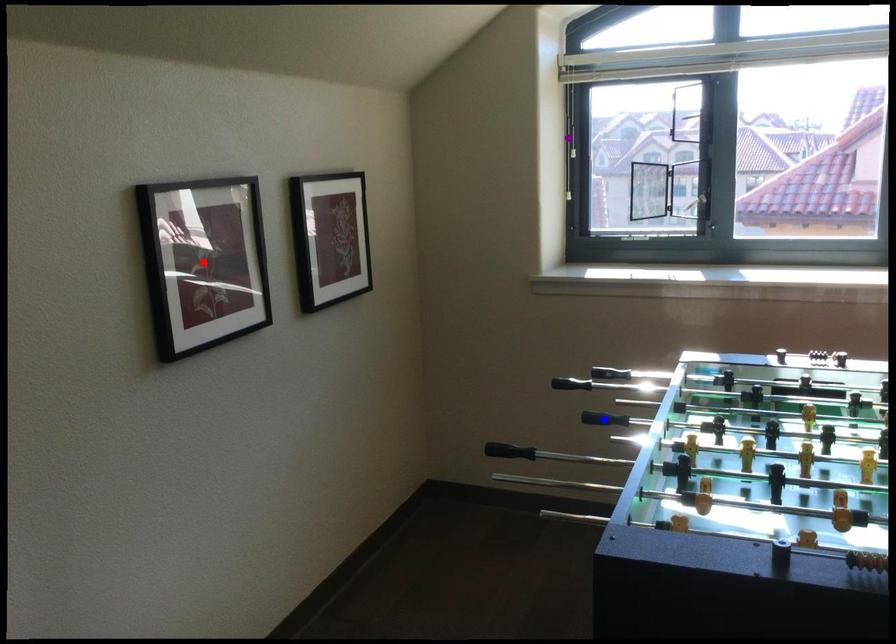
Order these from nearest to farthest:
purple point | red point | blue point

red point, blue point, purple point